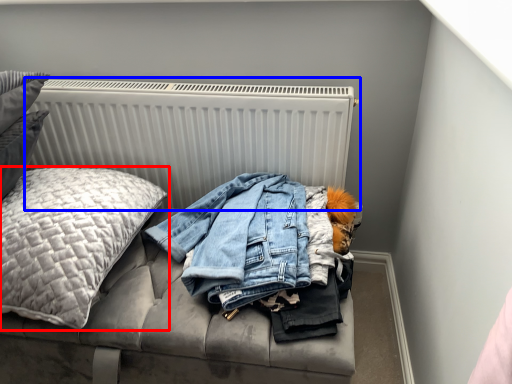
Question: Among these objects, which one is farthest to the camera, pillow (highlighted by a red box) or radiator (highlighted by a blue box)?

Choices:
 (A) pillow
 (B) radiator

Answer: (B)